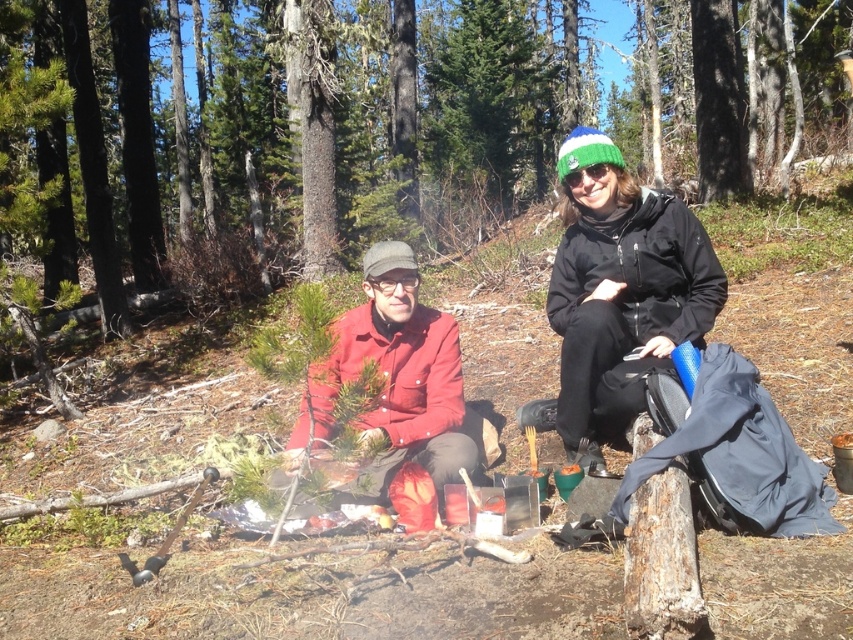
Question: Which object is positioned closest to the red matte shirt at center?

Choices:
 (A) matte red shirt at center
 (B) black matte jacket at center

Answer: (B)

Question: In this image, where is black matte jacket at center located relative to matte red shirt at center?

Choices:
 (A) left
 (B) right

Answer: (B)

Question: Which point is closer to the camera?

Choices:
 (A) (657, 269)
 (B) (445, 461)
 (C) (602, 164)

Answer: (B)

Question: Which point is farther to the camera?

Choices:
 (A) matte red shirt at center
 (B) black matte jacket at center

Answer: (B)

Question: Is red matte shirt at center thinner than matte red shirt at center?

Choices:
 (A) no
 (B) yes

Answer: (B)

Question: From the image, what is the correct spatial relationship of red matte shirt at center in relation to matte red shirt at center?

Choices:
 (A) above
 (B) below

Answer: (A)